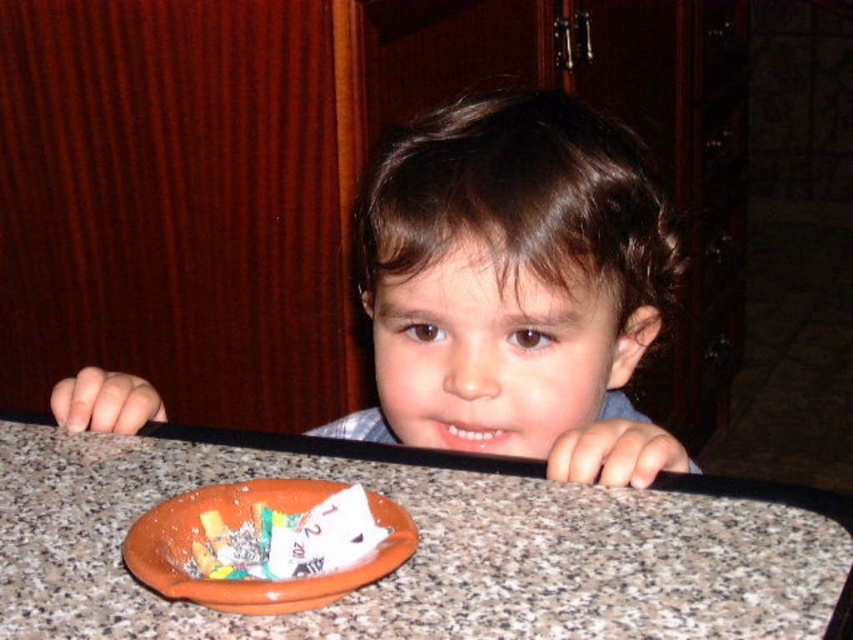
Is brown marble table at center thinner than white paper candy at center?

In fact, brown marble table at center might be wider than white paper candy at center.

Which of these two, brown marble table at center or white paper candy at center, stands shorter?

white paper candy at center

Measure the distance between point (45, 552) and camera.

19.36 inches

The image size is (853, 640). I want to click on brown marble table at center, so click(x=426, y=545).

Between brown hair at center and white paper candy at center, which one is positioned higher?

Positioned higher is brown hair at center.

Which is below, brown hair at center or white paper candy at center?

Positioned lower is white paper candy at center.

Is point (614, 240) positioned before point (367, 515)?

No, it is not.

Identify the location of brown hair at center. (515, 289).

Which is behind, point (780, 516) or point (386, 236)?

Positioned behind is point (386, 236).

Where is `brown marble table at center`? This screenshot has width=853, height=640. brown marble table at center is located at coordinates (426, 545).